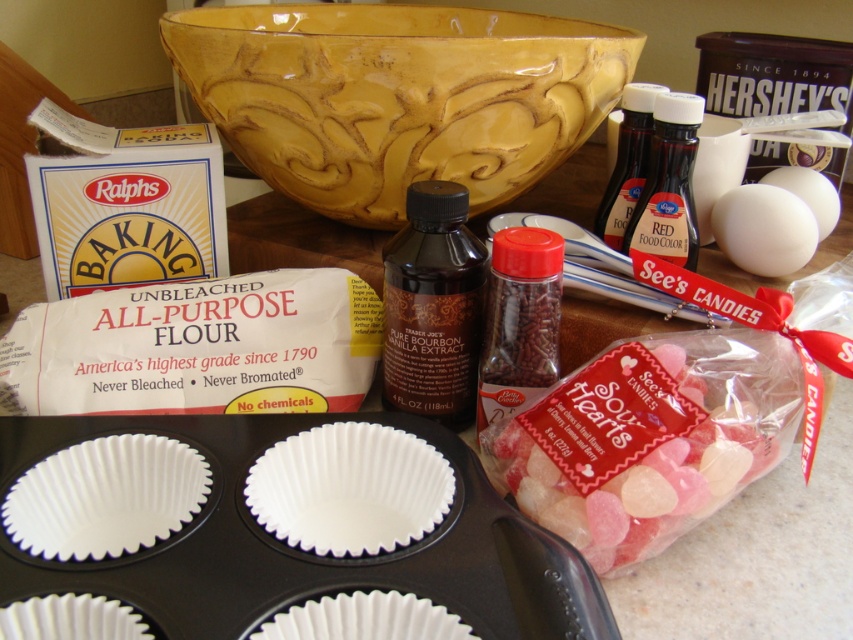
Can you confirm if pink translucent hearts at center right is positioned to the right of dark brown liquid at center?

Yes, pink translucent hearts at center right is to the right of dark brown liquid at center.

Is pink translucent hearts at center right smaller than dark brown liquid at center?

Incorrect, pink translucent hearts at center right is not smaller in size than dark brown liquid at center.

This screenshot has height=640, width=853. What are the coordinates of `pink translucent hearts at center right` in the screenshot? It's located at (650, 440).